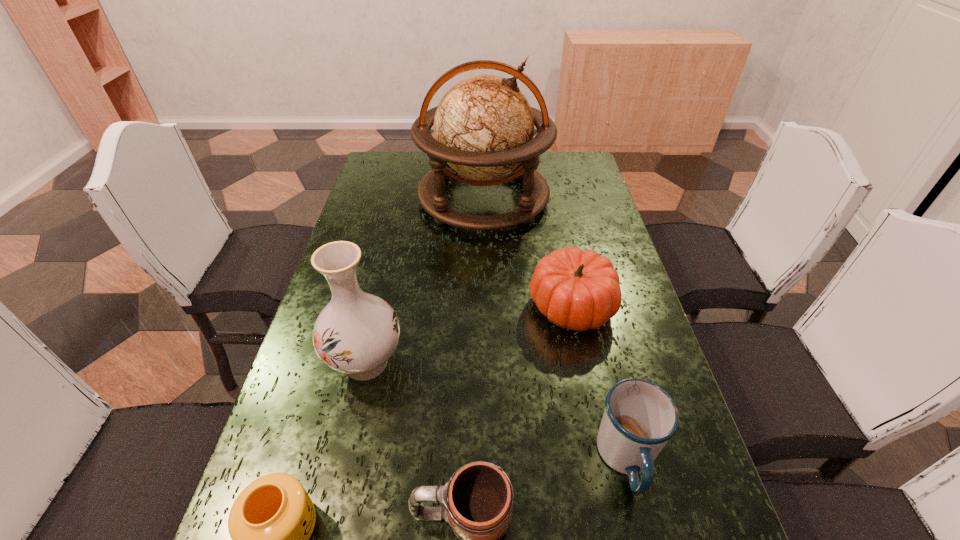
Where is `the tallest object`? This screenshot has width=960, height=540. the tallest object is located at coordinates (483, 126).

What are the coordinates of `globe` in the screenshot? It's located at (483, 126).

Where is `vase`? vase is located at coordinates (356, 333).

Locate an element on the screen. Image resolution: width=960 pixels, height=540 pixels. pumpkin is located at coordinates (575, 289).

Locate an element on the screen. This screenshot has width=960, height=540. the tallest mug is located at coordinates (639, 418).

Locate an element on the screen. This screenshot has height=540, width=960. free space located on the right of the globe is located at coordinates (571, 198).

This screenshot has width=960, height=540. I want to click on vacant position located 0.370m on the right of the fifth shortest object, so click(x=566, y=362).

I want to click on vacant area located 0.380m on the back of the pumpkin, so click(549, 200).

Locate an element on the screen. object present at the far edge is located at coordinates (483, 126).

Image resolution: width=960 pixels, height=540 pixels. I want to click on object at the left edge, so [356, 333].